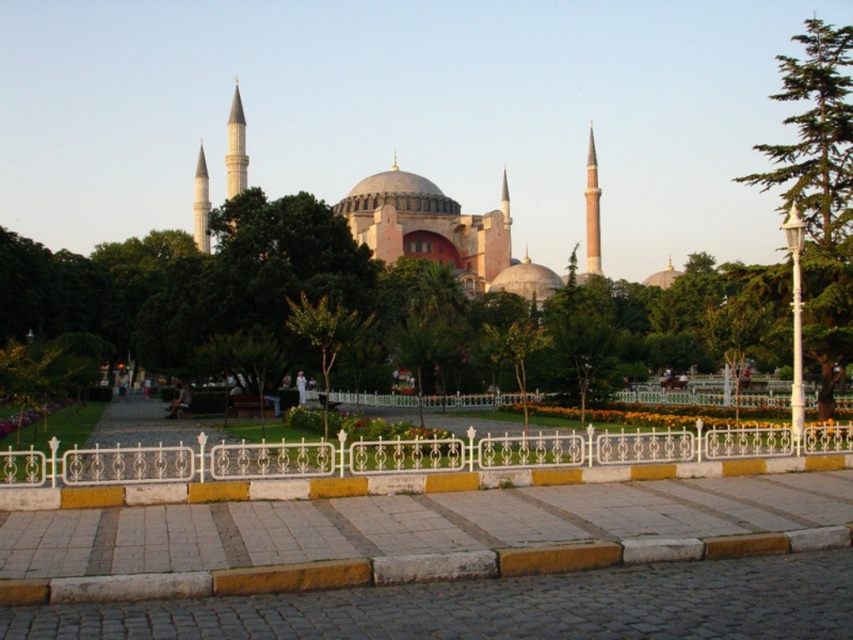
Question: Is white wrought iron fence at center positioned behind green leafy tree at right?

Choices:
 (A) yes
 (B) no

Answer: (B)

Question: Which of the following is the farthest from the observer?

Choices:
 (A) white wrought iron fence at center
 (B) green leafy tree at right

Answer: (B)

Question: Does white wrought iron fence at center appear on the left side of green leafy tree at right?

Choices:
 (A) no
 (B) yes

Answer: (B)

Question: Which of the following is the closest to the observer?

Choices:
 (A) white wrought iron fence at center
 (B) green leafy tree at right

Answer: (A)

Question: Can you confirm if white wrought iron fence at center is positioned to the right of green leafy tree at right?

Choices:
 (A) no
 (B) yes

Answer: (A)